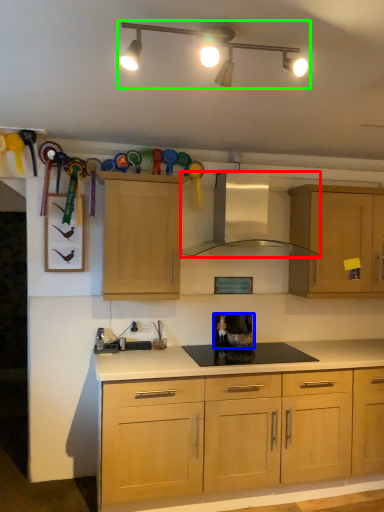
Question: Which object is the closest to the kitchen appliance (highlighted by a red box)? Choose among these: appliance (highlighted by a blue box) or light fixture (highlighted by a green box).

Choices:
 (A) appliance
 (B) light fixture

Answer: (A)